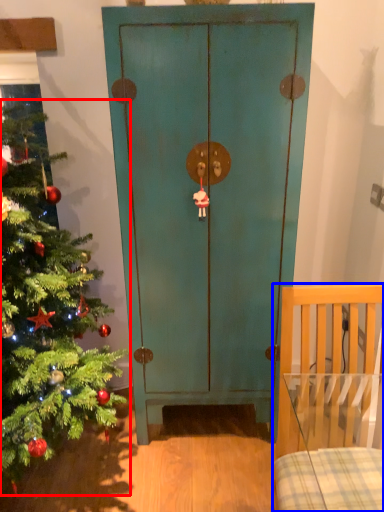
Question: Which of the following is the farthest to the observer, christmas tree (highlighted by a red box) or furniture (highlighted by a blue box)?

Choices:
 (A) christmas tree
 (B) furniture

Answer: (B)